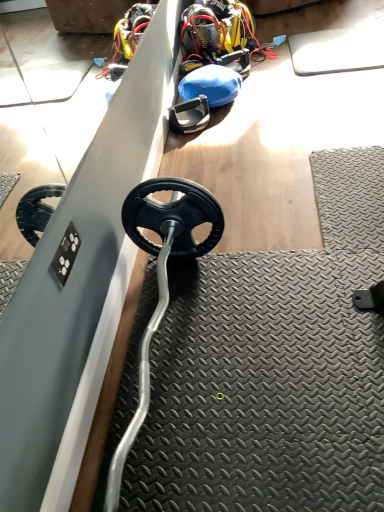
The width and height of the screenshot is (384, 512). Identify the location of vacant region in front of black rubber wheel at center. (196, 142).